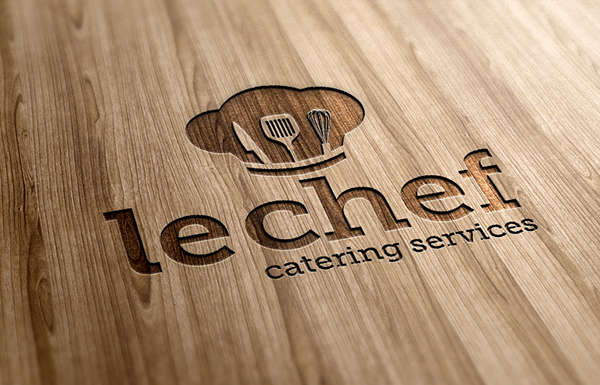
Identify the location of table. (506, 65).